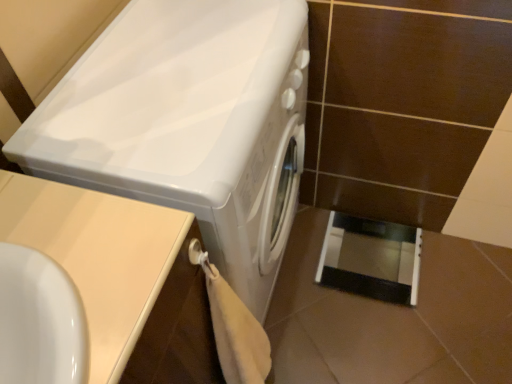
Identify the location of free space in front of black glossy screen door at lower right. (394, 336).